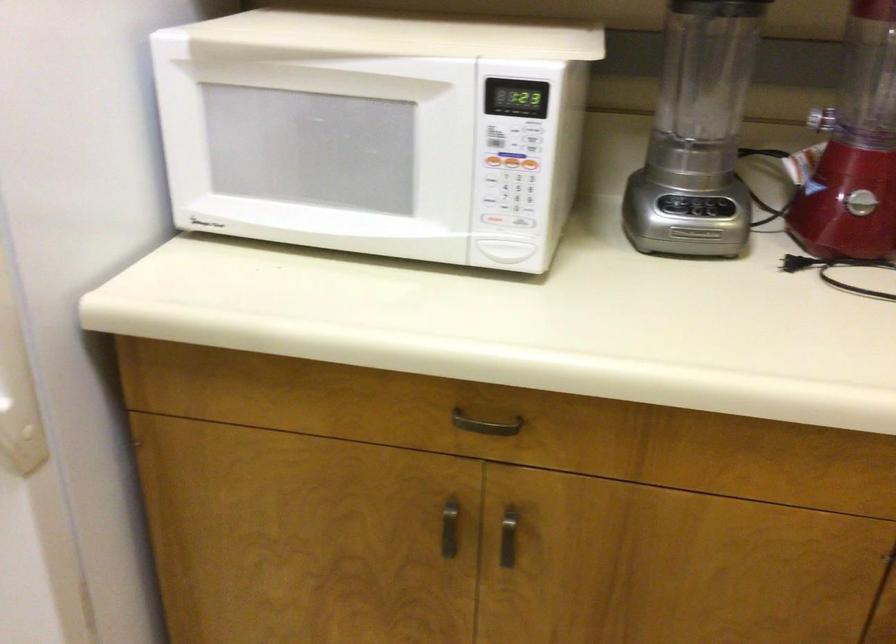
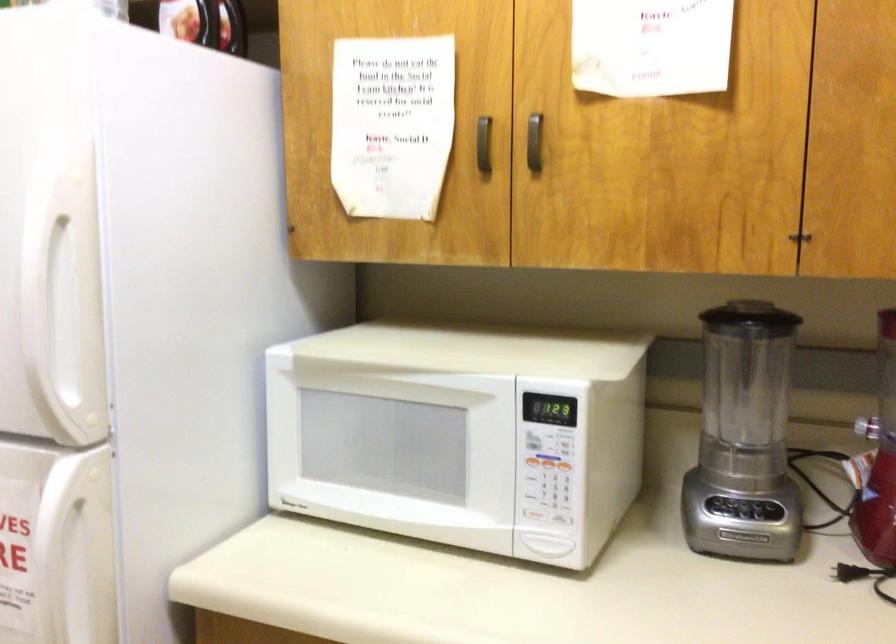
Locate, in the second image, the point that corresponds to (721,204) in the first image.

(771, 509)